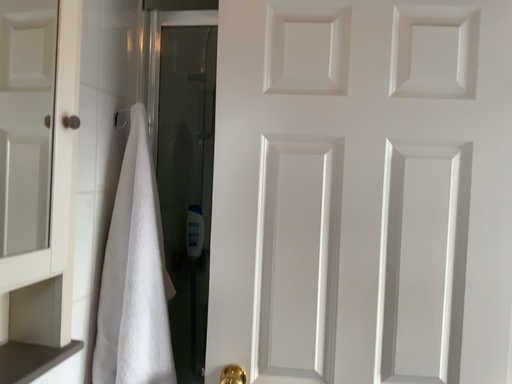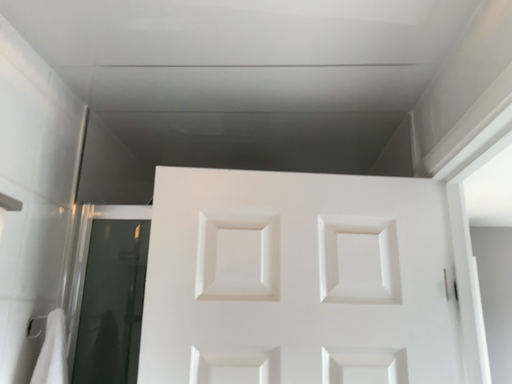
Question: Which way did the camera rotate in the video?

Choices:
 (A) rotated right
 (B) rotated left

Answer: (A)